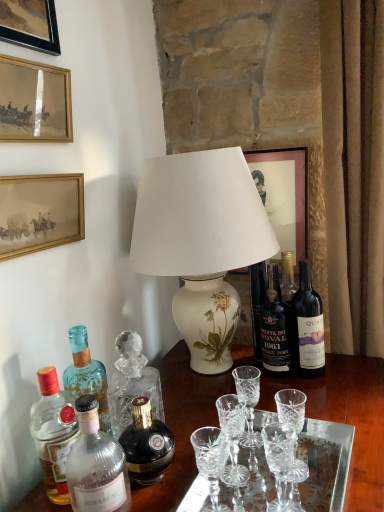
Question: From a real-world perspective, is wooden picture frame at upper left, which is the first picture frame in left-to-right order, physically located above or below clear glass bottle at lower left, the 2th bottle in the left-to-right sequence?

Choices:
 (A) below
 (B) above

Answer: (B)

Question: Considering the positions of wooden picture frame at upper left, which is the first picture frame in left-to-right order, and clear glass bottle at lower left, the 2th bottle in the left-to-right sequence, in the image, is wooden picture frame at upper left, which is the first picture frame in left-to-right order, taller or shorter than clear glass bottle at lower left, the 2th bottle in the left-to-right sequence,?

Choices:
 (A) short
 (B) tall

Answer: (B)

Question: Based on their relative distances, which object is farther from the white porcelain lamp at center?

Choices:
 (A) wooden picture frame at upper left, which is the first picture frame in left-to-right order
 (B) dark glass bottle at right, acting as the first bottle starting from the right
 (C) clear glass bottle at lower left, which is the fourth bottle from right to left
 (D) clear crystal tray at center
 (E) matte white picture frame at upper center, arranged as the 1th picture frame when viewed from the right

Answer: (A)

Question: Which of these objects is positioned farthest from the dark blue glass bottle at center, the 4th bottle positioned from the left?

Choices:
 (A) translucent glass bottle at left, which is the 5th bottle in right-to-left order
 (B) shiny dark glass bottle at center, the third bottle when ordered from left to right
 (C) gold-framed picture at upper left, which is the third picture frame from left to right
 (D) clear glass bottle at lower left, which is the fourth bottle from right to left
 (E) dark glass bottle at right, marked as the 5th bottle in a left-to-right arrangement

Answer: (C)